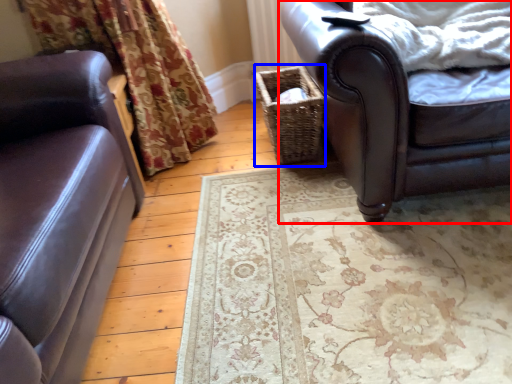
Question: Which of the following is the farthest to the observer, chair (highlighted by a red box) or basket (highlighted by a blue box)?

Choices:
 (A) chair
 (B) basket

Answer: (B)